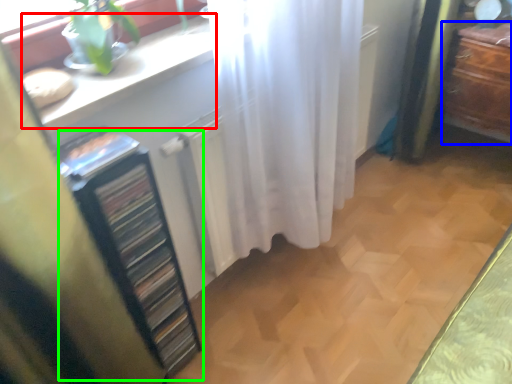
Question: Estimate the real-world distances between objects in this image. Which object is farther from counter top (highlighted by a red box), furniture (highlighted by a blue box) or file cabinet (highlighted by a green box)?

Choices:
 (A) furniture
 (B) file cabinet

Answer: (A)